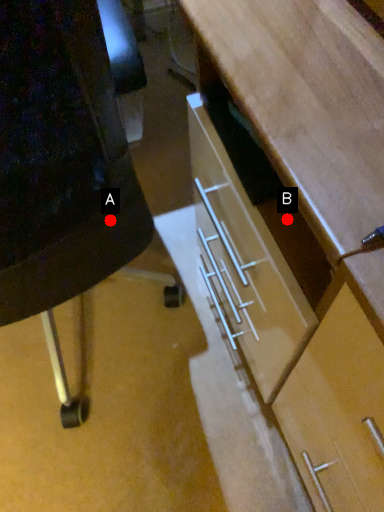
Question: Two points are circled on the image, labeled by A and B beside each circle. Which point is closer to the camera?

Choices:
 (A) A is closer
 (B) B is closer

Answer: (B)